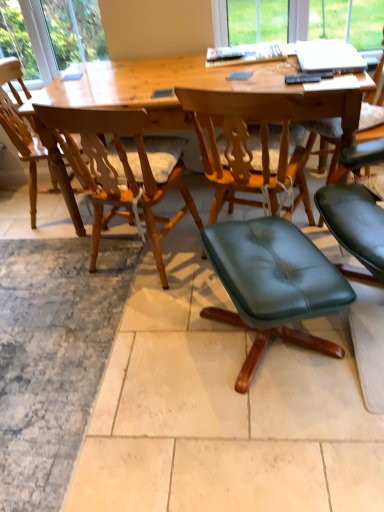
Question: Does green leather ottoman at lower right, marked as the 2th chair in a right-to-left arrangement, come in front of light wood chair at center, which is the 1th chair from left to right?

Choices:
 (A) yes
 (B) no

Answer: (A)

Question: Can you see green leather ottoman at lower right, the 3th chair when ordered from left to right, touching light wood chair at center, the 4th chair from the right?

Choices:
 (A) yes
 (B) no

Answer: (B)

Question: Is light wood chair at center, which is the 1th chair from left to right, at the back of green leather ottoman at lower right, marked as the 2th chair in a right-to-left arrangement?

Choices:
 (A) yes
 (B) no

Answer: (B)

Question: From a real-world perspective, is green leather ottoman at lower right, marked as the 2th chair in a right-to-left arrangement, on light wood chair at center, the 4th chair from the right?

Choices:
 (A) no
 (B) yes

Answer: (A)

Question: From a real-world perspective, is green leather ottoman at lower right, the 3th chair when ordered from left to right, under light wood chair at center, which is the 1th chair from left to right?

Choices:
 (A) yes
 (B) no

Answer: (A)

Question: Considering the relative positions of green leather ottoman at lower right, marked as the 2th chair in a right-to-left arrangement, and wooden chair at center, which is the second chair from left to right, in the image provided, is green leather ottoman at lower right, marked as the 2th chair in a right-to-left arrangement, to the left or to the right of wooden chair at center, which is the second chair from left to right,?

Choices:
 (A) left
 (B) right

Answer: (B)

Question: Which is correct: green leather ottoman at lower right, the 3th chair when ordered from left to right, is inside wooden chair at center, which is the second chair from left to right, or outside of it?

Choices:
 (A) inside
 (B) outside

Answer: (B)

Question: In the image, is green leather ottoman at lower right, the 3th chair when ordered from left to right, positioned in front of or behind wooden chair at center, acting as the 3th chair starting from the right?

Choices:
 (A) front
 (B) behind

Answer: (A)

Question: Looking at the image, does green leather ottoman at lower right, marked as the 2th chair in a right-to-left arrangement, seem bigger or smaller compared to wooden chair at center, which is the second chair from left to right?

Choices:
 (A) small
 (B) big

Answer: (A)

Question: Is wooden desk at center wider or thinner than light wood chair at center, the 4th chair from the right?

Choices:
 (A) wide
 (B) thin

Answer: (A)

Question: In terms of size, does wooden desk at center appear bigger or smaller than light wood chair at center, the 4th chair from the right?

Choices:
 (A) big
 (B) small

Answer: (A)

Question: Is wooden desk at center to the left or to the right of light wood chair at center, which is the 1th chair from left to right, in the image?

Choices:
 (A) right
 (B) left

Answer: (A)

Question: From a real-world perspective, is wooden desk at center physically located above or below light wood chair at center, the 4th chair from the right?

Choices:
 (A) below
 (B) above

Answer: (A)

Question: Is green leather ottoman at lower right, the 3th chair when ordered from left to right, bigger or smaller than light wood chair at center, the 4th chair from the right?

Choices:
 (A) big
 (B) small

Answer: (B)

Question: Is green leather ottoman at lower right, marked as the 2th chair in a right-to-left arrangement, inside the boundaries of light wood chair at center, which is the 1th chair from left to right, or outside?

Choices:
 (A) inside
 (B) outside

Answer: (B)